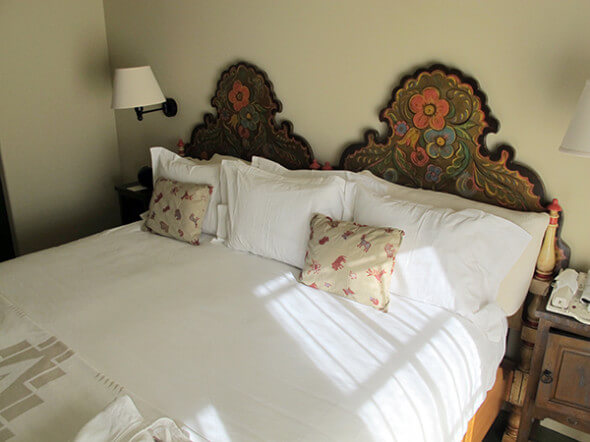
Where is `door handle`? The height and width of the screenshot is (442, 590). door handle is located at coordinates (546, 375).